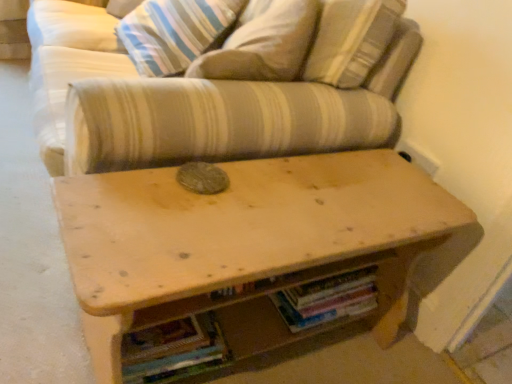
Question: Is striped fabric pillow at upper center positioned behind hardcover books at center, which ranks as the 2th book in left-to-right order?

Choices:
 (A) yes
 (B) no

Answer: (A)

Question: From the image's perspective, does striped fabric pillow at upper center appear higher than hardcover books at center, which ranks as the 2th book in left-to-right order?

Choices:
 (A) yes
 (B) no

Answer: (A)

Question: Would you say striped fabric pillow at upper center contains hardcover books at center, which ranks as the 2th book in left-to-right order?

Choices:
 (A) yes
 (B) no

Answer: (B)

Question: Can you confirm if striped fabric pillow at upper center is shorter than hardcover books at center, the 1th book viewed from the right?

Choices:
 (A) no
 (B) yes

Answer: (A)

Question: Is striped fabric pillow at upper center bigger than hardcover books at center, which ranks as the 2th book in left-to-right order?

Choices:
 (A) no
 (B) yes

Answer: (B)

Question: Does striped fabric pillow at upper center have a greater height compared to hardcover books at center, the 1th book viewed from the right?

Choices:
 (A) yes
 (B) no

Answer: (A)

Question: Considering the relative sizes of multicolored paper book at lower center, acting as the 1th book starting from the left, and striped fabric couch at center in the image provided, is multicolored paper book at lower center, acting as the 1th book starting from the left, thinner than striped fabric couch at center?

Choices:
 (A) yes
 (B) no

Answer: (A)

Question: Is multicolored paper book at lower center, acting as the second book starting from the right, looking in the opposite direction of striped fabric couch at center?

Choices:
 (A) no
 (B) yes

Answer: (A)

Question: Considering the relative positions of multicolored paper book at lower center, acting as the second book starting from the right, and striped fabric couch at center in the image provided, is multicolored paper book at lower center, acting as the second book starting from the right, to the left of striped fabric couch at center from the viewer's perspective?

Choices:
 (A) yes
 (B) no

Answer: (A)

Question: Is multicolored paper book at lower center, acting as the 1th book starting from the left, bigger than striped fabric couch at center?

Choices:
 (A) no
 (B) yes

Answer: (A)

Question: Are multicolored paper book at lower center, acting as the 1th book starting from the left, and striped fabric couch at center located far from each other?

Choices:
 (A) yes
 (B) no

Answer: (B)

Question: From the image's perspective, is multicolored paper book at lower center, acting as the second book starting from the right, located above striped fabric couch at center?

Choices:
 (A) no
 (B) yes

Answer: (A)

Question: Considering the relative sizes of striped fabric couch at center and wooden table at center in the image provided, is striped fabric couch at center shorter than wooden table at center?

Choices:
 (A) yes
 (B) no

Answer: (A)